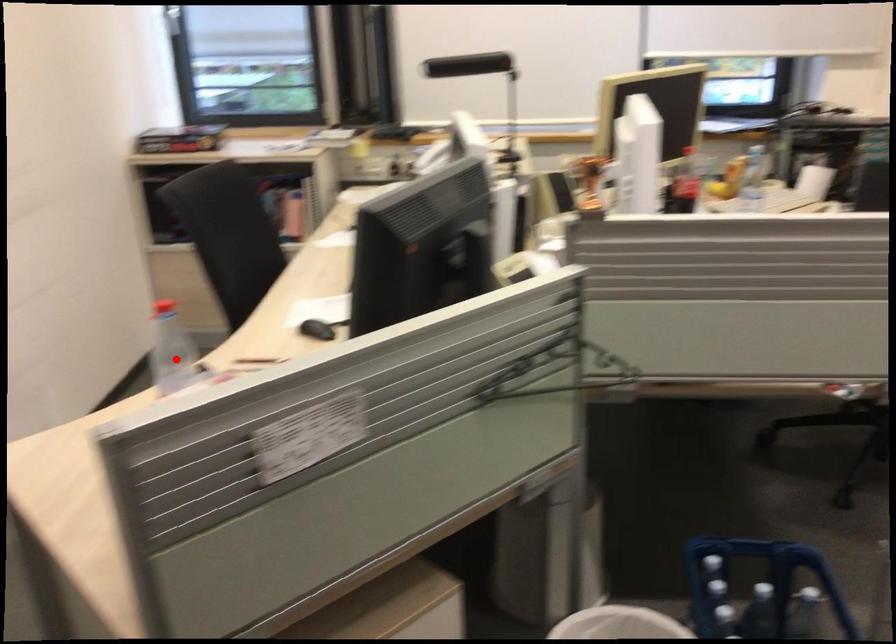
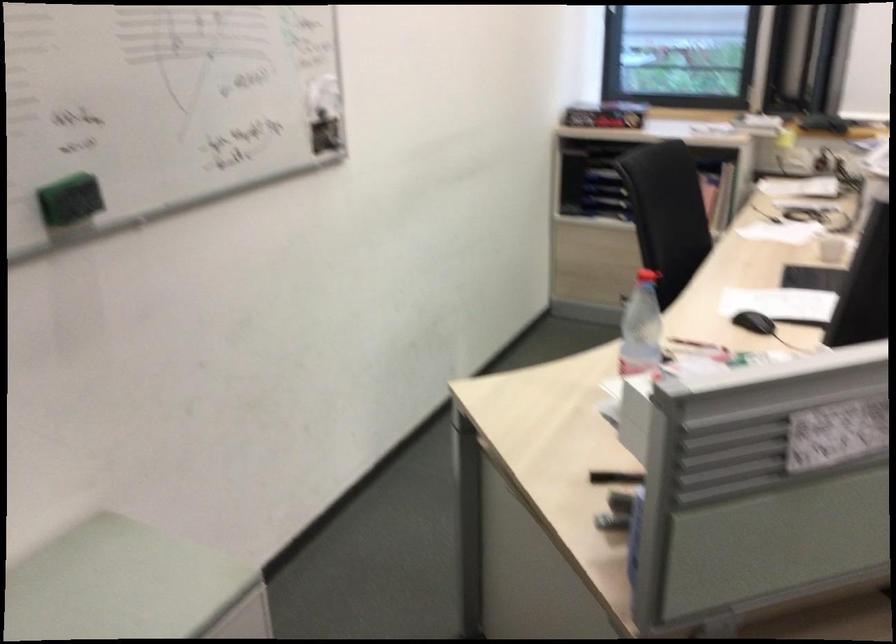
Find the pixel in the second image that matches the highlighted location in the first image.

(641, 327)